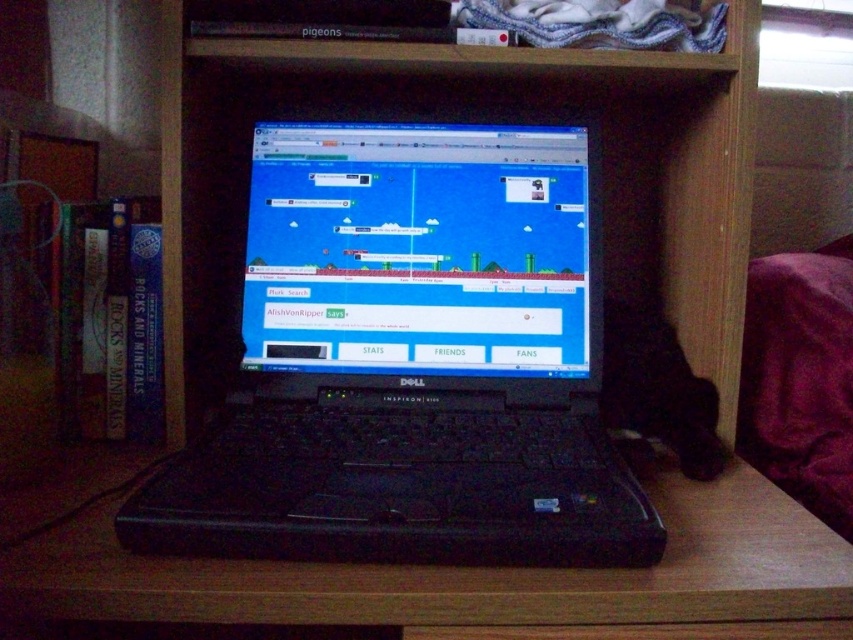
Question: Does black plastic laptop at center appear over black plastic table at center?

Choices:
 (A) yes
 (B) no

Answer: (A)

Question: Does black plastic laptop at center appear over black plastic table at center?

Choices:
 (A) yes
 (B) no

Answer: (A)

Question: Does black plastic laptop at center have a greater width compared to black plastic table at center?

Choices:
 (A) yes
 (B) no

Answer: (B)

Question: Which of the following is the farthest from the observer?

Choices:
 (A) (292, 577)
 (B) (309, 202)

Answer: (B)

Question: Which object appears farthest from the camera in this image?

Choices:
 (A) black plastic table at center
 (B) black plastic laptop at center

Answer: (B)